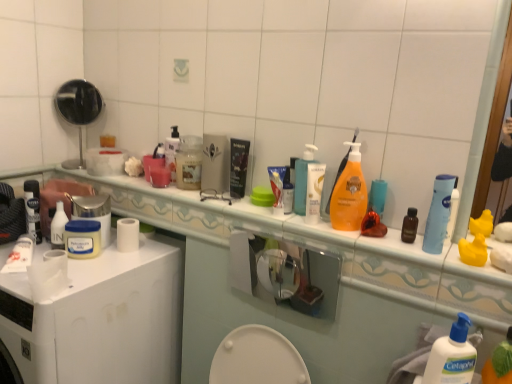
Find the location of `vacant space in front of translucent plastic jar at center, which is the 2th mouthwash from left to right`. vacant space in front of translucent plastic jar at center, which is the 2th mouthwash from left to right is located at coordinates (193, 197).